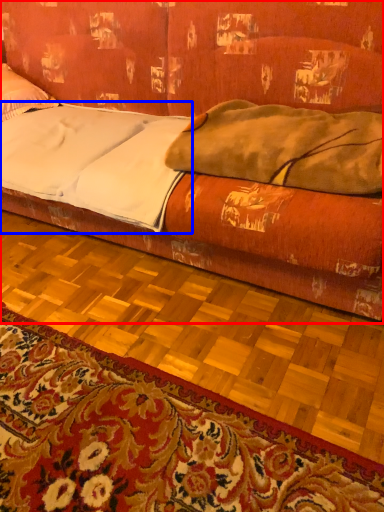
Question: Which of the following is the farthest to the observer, studio couch (highlighted by a red box) or sheet (highlighted by a blue box)?

Choices:
 (A) studio couch
 (B) sheet

Answer: (B)